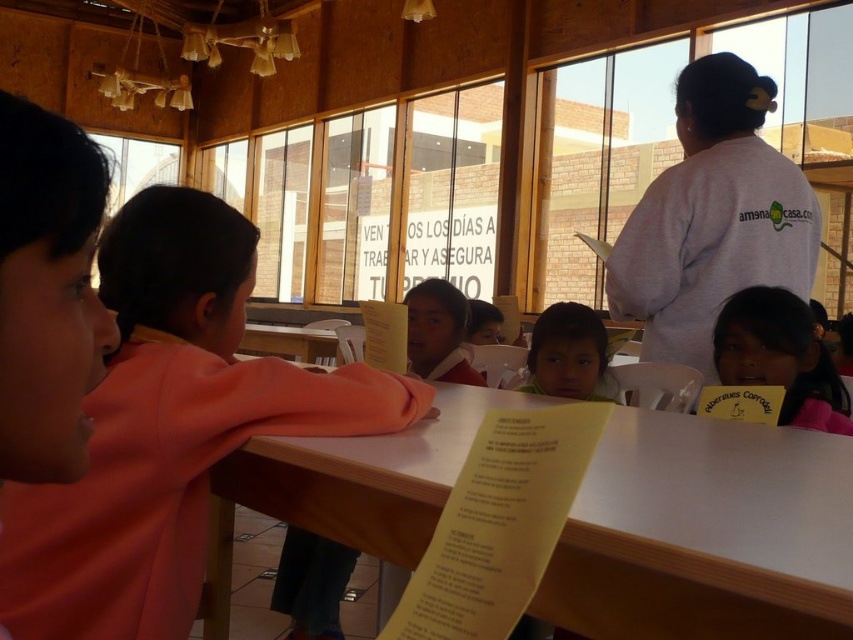
Question: Among these objects, which one is farthest from the camera?

Choices:
 (A) matte pink shirt at center
 (B) smooth skin child at center

Answer: (A)

Question: Which point appears closest to the camera in this image?

Choices:
 (A) (817, 536)
 (B) (138, 256)
 (C) (802, 225)

Answer: (A)

Question: Is pink fabric shirt at left smaller than matte pink shirt at center?

Choices:
 (A) yes
 (B) no

Answer: (B)

Question: Considering the real-world distances, which object is farthest from the white wood table at center?

Choices:
 (A) smooth skin child at center
 (B) matte pink shirt at center
 (C) white cotton shirt at upper right
 (D) pink fabric headband at upper right

Answer: (B)

Question: Is pink fabric shirt at left above pink fabric headband at upper right?

Choices:
 (A) no
 (B) yes

Answer: (A)

Question: Where is smooth skin child at center located in relation to matte pink shirt at center in the image?

Choices:
 (A) below
 (B) above

Answer: (A)